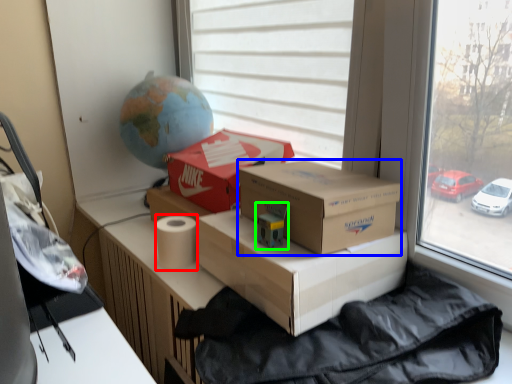
Question: Estimate the real-world distances between objects in this image. Which object is closer to toilet paper (highlighted by a red box), box (highlighted by a blue box) or toy (highlighted by a green box)?

Choices:
 (A) box
 (B) toy

Answer: (B)